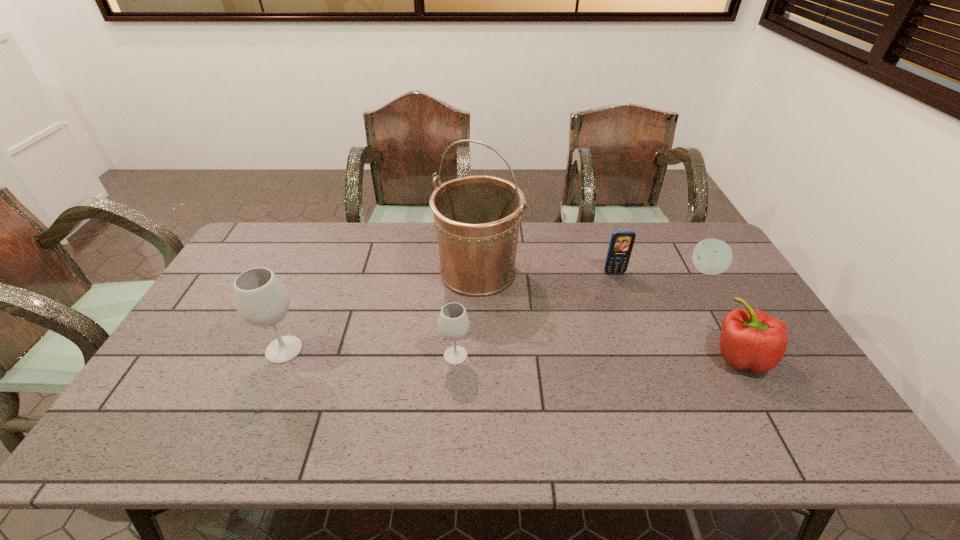
Locate an element on the screen. This screenshot has height=540, width=960. free point that keeps the wineglasss evenly spaced on the right is located at coordinates (632, 361).